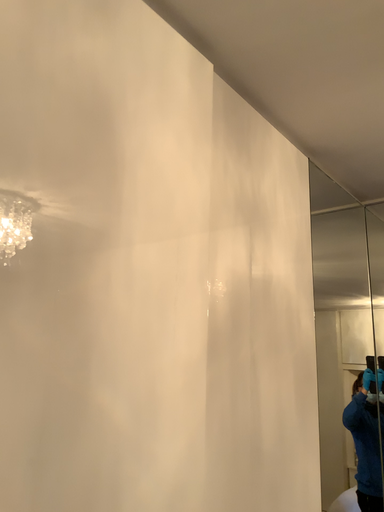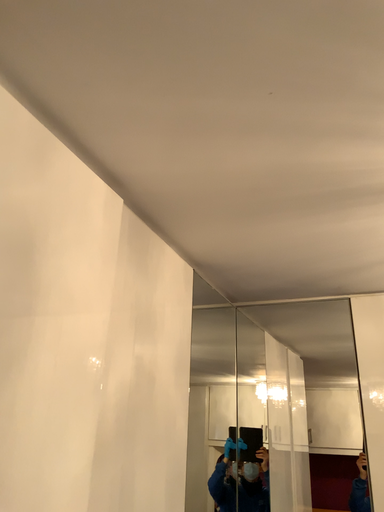
Question: How did the camera likely rotate when shooting the video?

Choices:
 (A) rotated downward
 (B) rotated upward

Answer: (B)